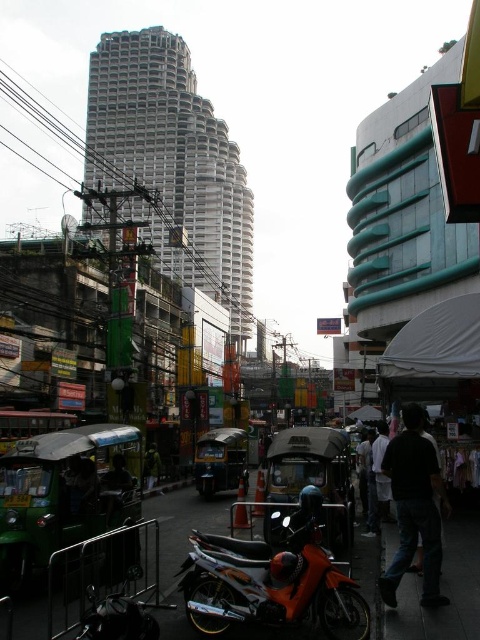
Is orange matte motorcycle at lower center to the left of dark matte clothing at lower right from the viewer's perspective?

Yes, orange matte motorcycle at lower center is to the left of dark matte clothing at lower right.

Is orange matte motorcycle at lower center bigger than dark matte clothing at lower right?

Correct, orange matte motorcycle at lower center is larger in size than dark matte clothing at lower right.

The height and width of the screenshot is (640, 480). Describe the element at coordinates (271, 586) in the screenshot. I see `orange matte motorcycle at lower center` at that location.

Where is `orange matte motorcycle at lower center`? Image resolution: width=480 pixels, height=640 pixels. orange matte motorcycle at lower center is located at coordinates (271, 586).

Which is below, dark matte clothing at lower right or dark green tuk-tuk at center?

dark green tuk-tuk at center

Between dark matte clothing at lower right and dark green tuk-tuk at center, which one appears on the right side from the viewer's perspective?

dark matte clothing at lower right is more to the right.

Between point (439, 600) and point (155, 445), which one is positioned in front?

Positioned in front is point (439, 600).

At what (x,y) coordinates should I click in order to perform the action: click on dark matte clothing at lower right. Please return your answer as a coordinate pair (x, y). Looking at the image, I should click on (415, 508).

Is point (236, 547) farther from viewer compared to point (159, 461)?

No, it is not.

Does orange matte motorcycle at lower center appear under dark green tuk-tuk at center?

Incorrect, orange matte motorcycle at lower center is not positioned below dark green tuk-tuk at center.

Between point (230, 582) and point (152, 442), which one is positioned behind?

Point (152, 442)

This screenshot has height=640, width=480. What are the coordinates of `orange matte motorcycle at lower center` in the screenshot? It's located at (271, 586).